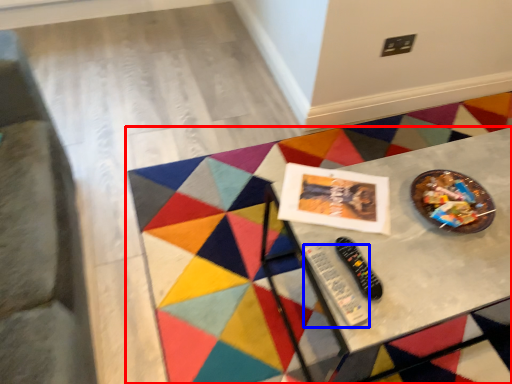
Question: Among these objects, which one is nearest to the camera, table (highlighted by a red box) or control (highlighted by a blue box)?

Choices:
 (A) table
 (B) control

Answer: (B)